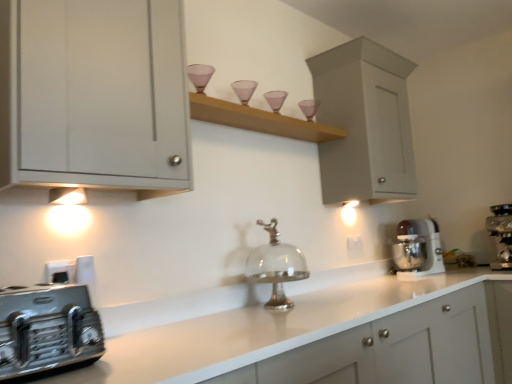
Find the location of a particular element. silver metallic bell at center is located at coordinates (276, 266).

Describe the element at coordinates (259, 120) in the screenshot. I see `wooden shelf at upper center` at that location.

This screenshot has height=384, width=512. I want to click on white plastic electric outlet at center, so click(x=354, y=244).

What is the approximate width of white matte cabinet at upper right, the first cabinetry viewed from the back?

white matte cabinet at upper right, the first cabinetry viewed from the back, is 38.66 centimeters wide.

Based on the photo, measure the distance between point (x=344, y=156) and camera.

A distance of 7.71 feet exists between point (x=344, y=156) and camera.

Find the location of a particular element. This screenshot has height=384, width=512. matte gray cabinet at upper left, which appears as the second cabinetry when viewed from the back is located at coordinates (94, 95).

Considering the positions of objects matte gray cabinet at upper left, the 1th cabinetry viewed from the front, and white plastic electric outlet at center in the image provided, who is in front, matte gray cabinet at upper left, the 1th cabinetry viewed from the front, or white plastic electric outlet at center?

matte gray cabinet at upper left, the 1th cabinetry viewed from the front.

Between matte gray cabinet at upper left, the 1th cabinetry viewed from the front, and white plastic electric outlet at center, which one has larger size?

Bigger between the two is matte gray cabinet at upper left, the 1th cabinetry viewed from the front.

Is matte gray cabinet at upper left, the first cabinetry from the left, oriented away from white plastic electric outlet at center?

matte gray cabinet at upper left, the first cabinetry from the left, is not turned away from white plastic electric outlet at center.

Find the location of a particular element. This screenshot has height=384, width=512. cabinetry on the left of white plastic electric outlet at center is located at coordinates (94, 95).

From the image's perspective, would you say metallic stainless steel coffee maker at right, which is counted as the second home appliance, starting from the back, is positioned over wooden shelf at upper center?

No.

Is metallic stainless steel coffee maker at right, the 1th home appliance from the right, completely or partially outside of wooden shelf at upper center?

Yes, metallic stainless steel coffee maker at right, the 1th home appliance from the right, is outside of wooden shelf at upper center.

Is point (505, 247) positioned before point (254, 128)?

No, (505, 247) is behind (254, 128).

From the image's perspective, count 1st home appliances downward from the wooden shelf at upper center and point to it. Please provide its 2D coordinates.

[(501, 235)]

Which is more to the right, white plastic electric outlet at center or white plastic stand mixer at right, the 3th home appliance from the front?

white plastic stand mixer at right, the 3th home appliance from the front.

Locate an element on the screen. The height and width of the screenshot is (384, 512). electric outlet above the white plastic stand mixer at right, which is the 2th home appliance from left to right (from the image's perspective) is located at coordinates (354, 244).

Looking at this image, which of these two, white plastic electric outlet at center or white plastic stand mixer at right, which is the 2th home appliance from left to right, is bigger?

white plastic stand mixer at right, which is the 2th home appliance from left to right, is bigger.

Considering the sizes of objects white plastic electric outlet at center and white plastic stand mixer at right, the first home appliance from the back, in the image provided, who is taller, white plastic electric outlet at center or white plastic stand mixer at right, the first home appliance from the back,?

With more height is white plastic stand mixer at right, the first home appliance from the back.

Considering the relative positions of matte gray cabinet at upper left, the second cabinetry in the right-to-left sequence, and white matte cabinet at upper right, the first cabinetry viewed from the back, in the image provided, is matte gray cabinet at upper left, the second cabinetry in the right-to-left sequence, to the left of white matte cabinet at upper right, the first cabinetry viewed from the back, from the viewer's perspective?

Yes.

Which point is more distant from viewer, (161, 97) or (317, 119)?

The point (317, 119) is farther from the camera.

Which object is thinner, matte gray cabinet at upper left, the first cabinetry from the left, or white matte cabinet at upper right, which is counted as the 1th cabinetry, starting from the right?

white matte cabinet at upper right, which is counted as the 1th cabinetry, starting from the right.

From the image's perspective, is matte gray cabinet at upper left, the second cabinetry in the right-to-left sequence, beneath white matte cabinet at upper right, the 2th cabinetry positioned from the front?

No, from the image's perspective, matte gray cabinet at upper left, the second cabinetry in the right-to-left sequence, is not below white matte cabinet at upper right, the 2th cabinetry positioned from the front.

Is point (239, 113) closer or farther from the camera than point (45, 293)?

Point (239, 113) is farther from the camera than point (45, 293).

Which object is further away from the camera, wooden shelf at upper center or metallic silver toaster at lower left, acting as the first home appliance starting from the left?

wooden shelf at upper center is more distant.

Which is behind, point (281, 285) or point (350, 250)?

The point (350, 250) is farther from the camera.

Where is `faucet in front of the white plastic electric outlet at center`? The height and width of the screenshot is (384, 512). faucet in front of the white plastic electric outlet at center is located at coordinates (276, 266).

Is white plastic electric outlet at center at the back of silver metallic bell at center?

No, silver metallic bell at center's orientation is not away from white plastic electric outlet at center.

Based on the photo, which object is positioned more to the right, silver metallic bell at center or wooden shelf at upper center?

Positioned to the right is silver metallic bell at center.

Consider the image. Is silver metallic bell at center thinner than wooden shelf at upper center?

No, silver metallic bell at center is not thinner than wooden shelf at upper center.

Who is more distant, silver metallic bell at center or wooden shelf at upper center?

silver metallic bell at center is behind.

This screenshot has height=384, width=512. Identify the location of cabinetry on the left of white plastic electric outlet at center. coord(94,95).

Find the location of `home appliance that is the 1st one when counting backward from the wooden shelf at upper center`. home appliance that is the 1st one when counting backward from the wooden shelf at upper center is located at coordinates (501, 235).

Which object lies further to the anchor point white plastic electric outlet at center, white matte cabinet at upper right, which is counted as the 1th cabinetry, starting from the right, or wooden shelf at upper center?

Among the two, wooden shelf at upper center is located further to white plastic electric outlet at center.

From the image, which object appears to be farther from white matte cabinet at upper right, the 2th cabinetry positioned from the front, white plastic electric outlet at center or silver metallic bell at center?

The object further to white matte cabinet at upper right, the 2th cabinetry positioned from the front, is silver metallic bell at center.

From the image, which object appears to be farther from white plastic electric outlet at center, matte gray cabinet at upper left, the 1th cabinetry viewed from the front, or white plastic stand mixer at right, the first home appliance from the back?

Based on the image, matte gray cabinet at upper left, the 1th cabinetry viewed from the front, appears to be further to white plastic electric outlet at center.

From the image, which object appears to be farther from matte gray cabinet at upper left, which appears as the second cabinetry when viewed from the back, wooden shelf at upper center or white plastic electric outlet at center?

white plastic electric outlet at center lies further to matte gray cabinet at upper left, which appears as the second cabinetry when viewed from the back, than the other object.

When comparing their distances from silver metallic bell at center, does metallic stainless steel coffee maker at right, positioned as the second home appliance in front-to-back order, or matte gray cabinet at upper left, the first cabinetry from the left, seem closer?

Based on the image, matte gray cabinet at upper left, the first cabinetry from the left, appears to be nearer to silver metallic bell at center.

Estimate the real-world distances between objects in this image. Which object is closer to white plastic stand mixer at right, the first home appliance from the back, wooden shelf at upper center or metallic silver toaster at lower left, which ranks as the third home appliance in right-to-left order?

wooden shelf at upper center lies closer to white plastic stand mixer at right, the first home appliance from the back, than the other object.

Which object lies nearer to the anchor point silver metallic bell at center, matte gray cabinet at upper left, the first cabinetry from the left, or metallic stainless steel coffee maker at right, the 1th home appliance from the right?

matte gray cabinet at upper left, the first cabinetry from the left, lies closer to silver metallic bell at center than the other object.

Estimate the real-world distances between objects in this image. Which object is closer to metallic stainless steel coffee maker at right, which is counted as the second home appliance, starting from the back, matte gray cabinet at upper left, the 1th cabinetry viewed from the front, or metallic silver toaster at lower left, acting as the first home appliance starting from the left?

The object closer to metallic stainless steel coffee maker at right, which is counted as the second home appliance, starting from the back, is matte gray cabinet at upper left, the 1th cabinetry viewed from the front.

You are a GUI agent. You are given a task and a screenshot of the screen. Output one action in this format:
    pyautogui.click(x=<x>, y=<y>)
    Task: Click on the shelf located between matte gray cabinet at upper left, the 1th cabinetry viewed from the front, and metallic stainless steel coffee maker at right, positioned as the second home appliance in front-to-back order, in the left-right direction
    The height and width of the screenshot is (384, 512).
    Given the screenshot: What is the action you would take?
    pyautogui.click(x=259, y=120)

You are a GUI agent. You are given a task and a screenshot of the screen. Output one action in this format:
    pyautogui.click(x=<x>, y=<y>)
    Task: Click on the faucet situated between wooden shelf at upper center and white plastic stand mixer at right, the first home appliance from the back, from left to right
    This screenshot has width=512, height=384.
    Given the screenshot: What is the action you would take?
    pyautogui.click(x=276, y=266)

This screenshot has height=384, width=512. I want to click on faucet between matte gray cabinet at upper left, which appears as the second cabinetry when viewed from the back, and white plastic stand mixer at right, the first home appliance from the back, along the z-axis, so click(x=276, y=266).

This screenshot has width=512, height=384. I want to click on shelf between metallic silver toaster at lower left, which ranks as the third home appliance in right-to-left order, and white plastic electric outlet at center in the front-back direction, so [x=259, y=120].